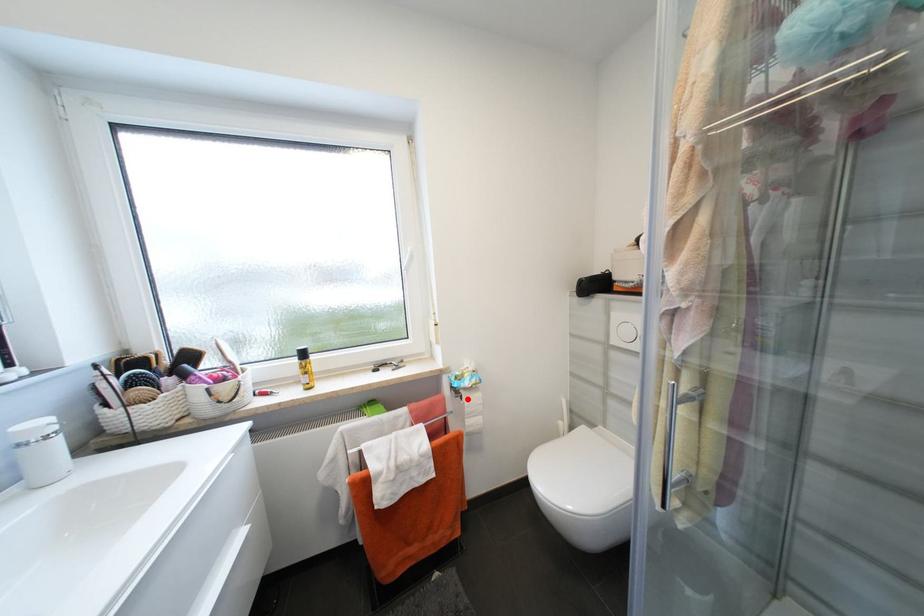
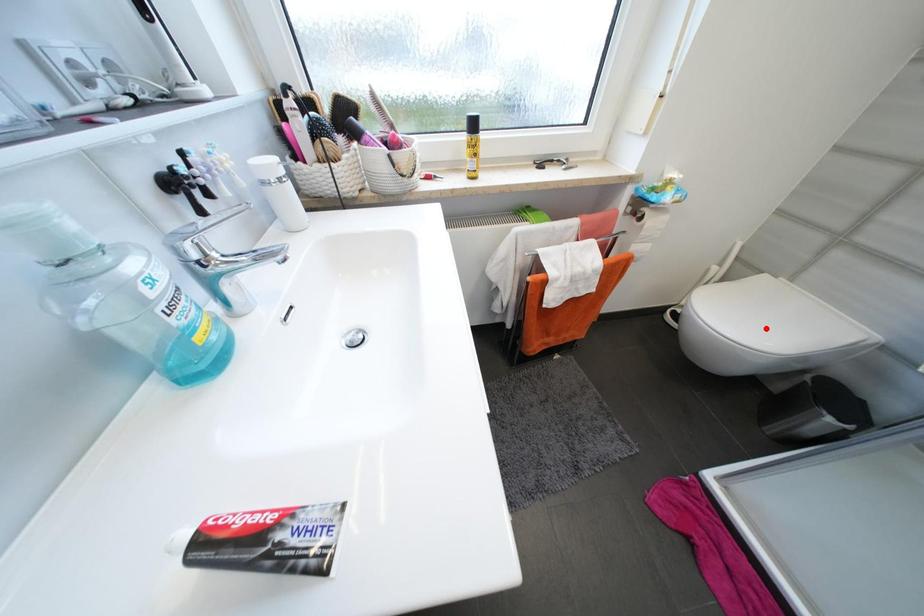
I am providing you with two images of the same scene from different viewpoints. A red point is marked on the first image and another point is marked on the second image. Is the marked point in image1 the same physical position as the marked point in image2?

No